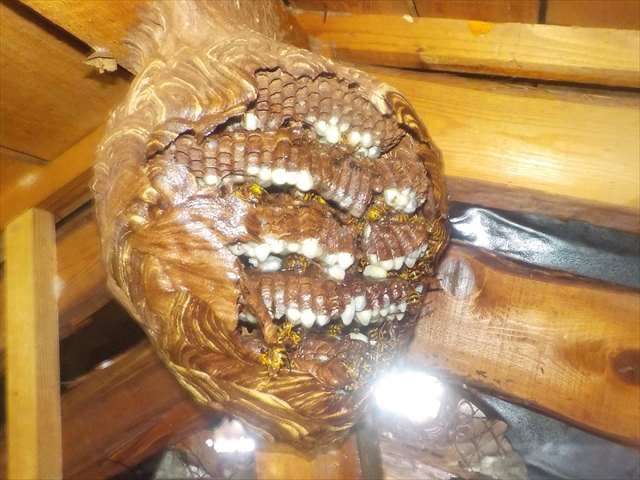
At what (x,y) coordinates should I click in order to perform the action: click on wall. Please return your answer as a coordinate pair (x, y). The image size is (640, 480). Looking at the image, I should click on (124, 404), (564, 354).